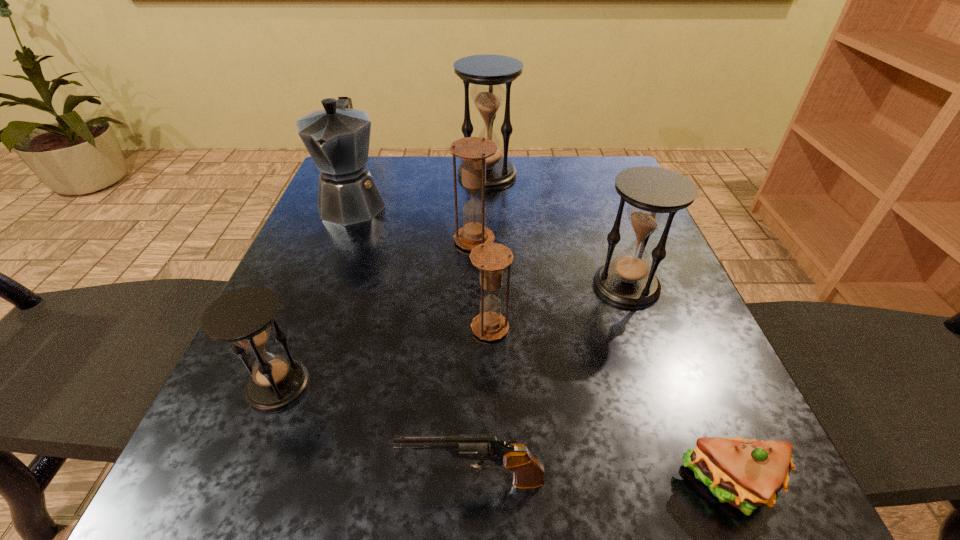
This screenshot has height=540, width=960. What are the coordinates of `free location located 0.280m along the barrel of the black gun` in the screenshot? It's located at [183, 481].

Image resolution: width=960 pixels, height=540 pixels. What are the coordinates of `vacant region located 0.270m along the barrel of the black gun` in the screenshot? It's located at (191, 481).

Where is `vacant space located 0.400m on the back of the sandwich`? The width and height of the screenshot is (960, 540). vacant space located 0.400m on the back of the sandwich is located at coordinates (639, 261).

This screenshot has height=540, width=960. I want to click on hourglass located in the far edge section of the desktop, so click(x=487, y=72).

Image resolution: width=960 pixels, height=540 pixels. Find the location of `coffeepot located at the far edge`. coffeepot located at the far edge is located at coordinates point(337,138).

Find the location of a particular element. Image resolution: width=960 pixels, height=540 pixels. gun present at the near edge is located at coordinates (528, 473).

This screenshot has height=540, width=960. Find the location of `sandwich at the near edge`. sandwich at the near edge is located at coordinates pos(745,473).

This screenshot has width=960, height=540. Identify the location of coffeepot that is at the left edge. (337, 138).

In order to click on hourglass at the left edge in this screenshot , I will do 243,316.

The width and height of the screenshot is (960, 540). Find the location of `hourglass that is at the right edge`. hourglass that is at the right edge is located at coordinates (654, 195).